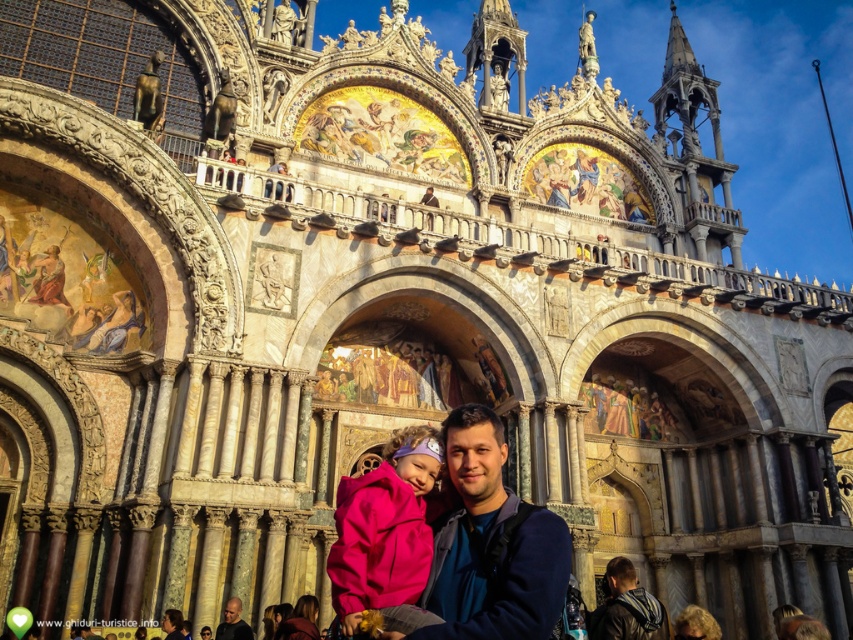
You are a photographer standing in front of the grand building. You notice the blue fabric at center and the pink fleece jacket at center in the scene. Which object is positioned higher from the ground?

The blue fabric at center is above the pink fleece jacket at center, so the blue fabric at center is higher from the ground.

You are standing in front of the grand cathedral with its intricate mosaics and statues. You see two points marked in the scene. The first point is at coordinates point (415, 467) and the second is at point (683, 612). Which point is closer to you?

Point (415, 467) is in front of point (683, 612), so it is closer to you.